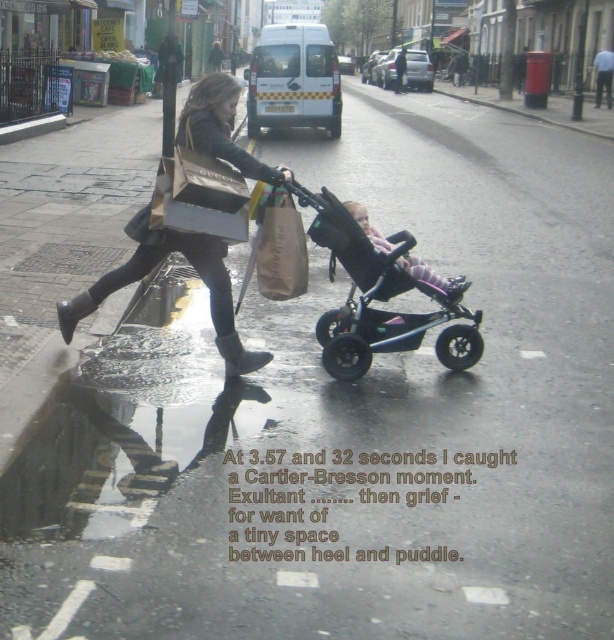
Question: Does matte brown paper bag at center come behind brown paper bag at center?

Choices:
 (A) no
 (B) yes

Answer: (A)

Question: Which point is closer to the camera?

Choices:
 (A) (182, 241)
 (B) (235, 342)
 (C) (286, 284)
 (D) (389, 244)

Answer: (A)

Question: Considering the real-world distances, which object is closest to the black rubber rain boot at lower left?

Choices:
 (A) black rubber rain boot at lower center
 (B) pink fabric stroller at center

Answer: (A)

Question: Is black plastic baby carriage at center closer to camera compared to black rubber rain boot at lower left?

Choices:
 (A) yes
 (B) no

Answer: (A)

Question: Which of the following is the closest to the observer?

Choices:
 (A) (270, 220)
 (B) (460, 285)
 (C) (341, 317)

Answer: (A)

Question: Does matte brown paper bag at center have a smaller size compared to pink fabric stroller at center?

Choices:
 (A) yes
 (B) no

Answer: (B)